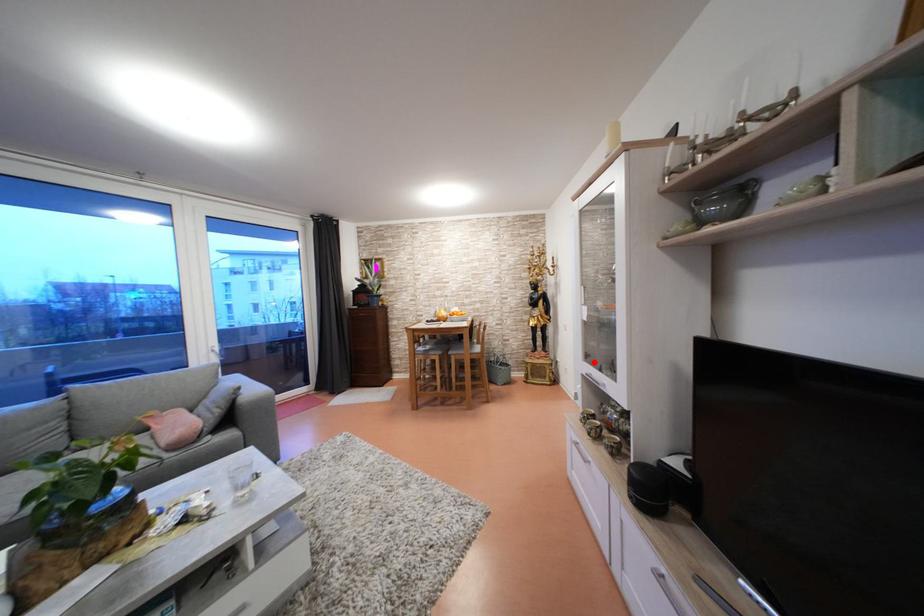
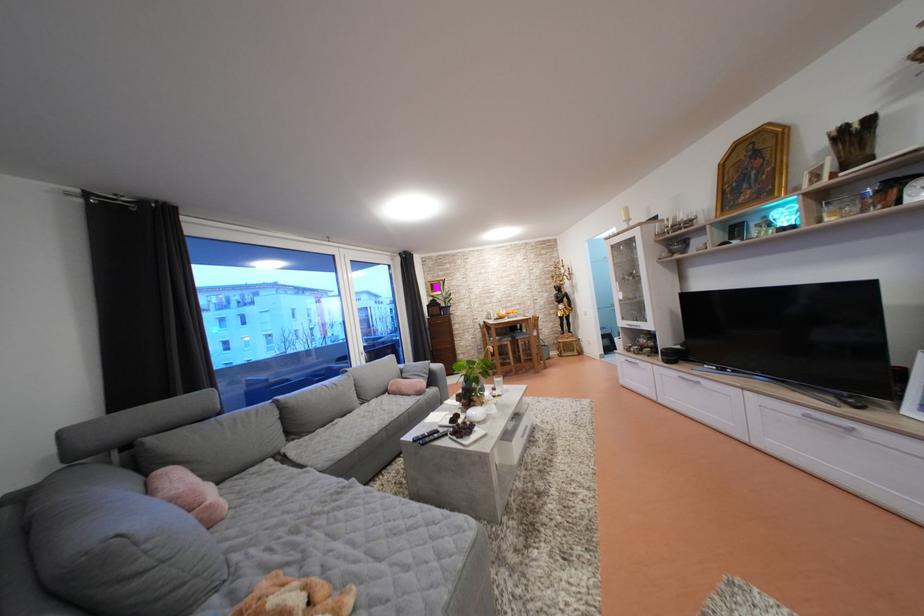
The point at the highlighted location is marked in the first image. Where is the corresponding point in the second image?

(629, 323)